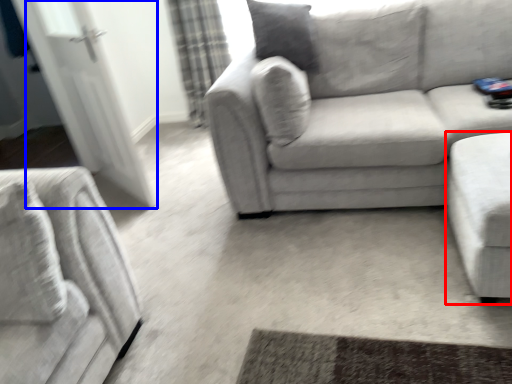
Question: Which of the following is the farthest to the observer, studio couch (highlighted by a red box) or glass door (highlighted by a blue box)?

Choices:
 (A) studio couch
 (B) glass door

Answer: (B)